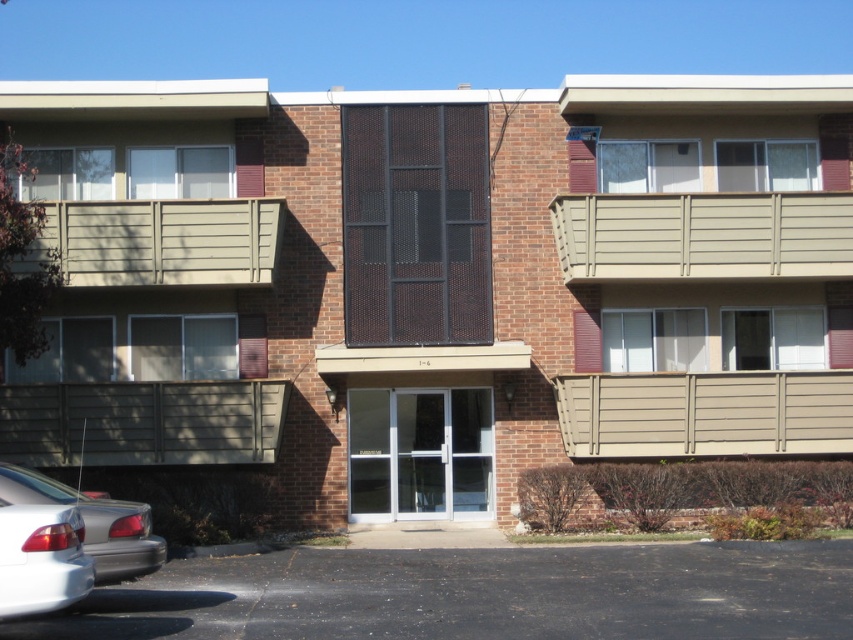
Between point (573, 451) and point (117, 432), which one is positioned in front?

Point (117, 432) is in front.

Is beige wood balcony at center taller than brown textured panel at lower left?

Yes.

This screenshot has width=853, height=640. Identify the location of beige wood balcony at center. (704, 413).

Is tan wood paneling at upper right closer to the viewer compared to beige wood balcony at center?

Yes, it is.

Is point (686, 212) positioned in front of point (780, 426)?

Yes, point (686, 212) is closer to viewer.

The image size is (853, 640). In order to click on tan wood paneling at upper right in this screenshot , I will do `click(703, 236)`.

Locate an element on the screen. Image resolution: width=853 pixels, height=640 pixels. tan wood paneling at upper right is located at coordinates (703, 236).

Image resolution: width=853 pixels, height=640 pixels. What do you see at coordinates (704, 413) in the screenshot?
I see `beige wood balcony at center` at bounding box center [704, 413].

The height and width of the screenshot is (640, 853). Describe the element at coordinates (704, 413) in the screenshot. I see `beige wood balcony at center` at that location.

Locate an element on the screen. beige wood balcony at center is located at coordinates (704, 413).